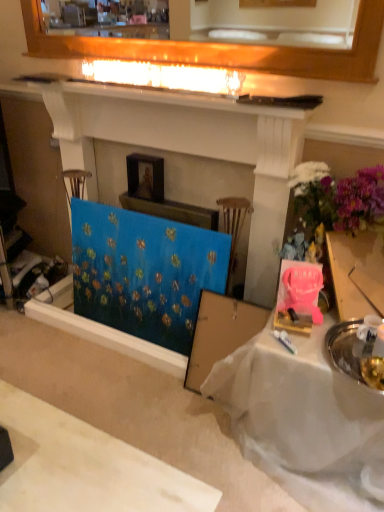
Describe the element at coordinates (175, 96) in the screenshot. I see `white glossy mantle at upper center` at that location.

Describe the element at coordinates (145, 177) in the screenshot. The image size is (384, 512). I see `wooden picture frame at upper center` at that location.

Find the location of a particular element. This screenshot has height=512, width=384. blue fabric painting at center is located at coordinates (144, 272).

This screenshot has height=512, width=384. What are the coordinates of `white cloth-covered table at lower right` in the screenshot? It's located at (303, 420).

Does white cloth-covered table at lower right touch wooden picture frame at upper center?

No, white cloth-covered table at lower right is not with wooden picture frame at upper center.

Relative to wooden picture frame at upper center, is white cloth-covered table at lower right in front or behind?

In the image, white cloth-covered table at lower right appears in front of wooden picture frame at upper center.

What's the angular difference between white cloth-covered table at lower right and wooden picture frame at upper center's facing directions?

white cloth-covered table at lower right and wooden picture frame at upper center are facing 0.00679 degrees away from each other.

Which is nearer, (319, 467) or (149, 186)?

Point (319, 467) is closer to the camera than point (149, 186).

Does point (256, 261) lie behind point (250, 416)?

Yes, point (256, 261) is farther from viewer.

Does blue canvas at center turn towards white cloth-covered table at lower right?

No, blue canvas at center does not turn towards white cloth-covered table at lower right.

Where is `table in front of the blue canvas at center`? table in front of the blue canvas at center is located at coordinates (303, 420).

How different are the orientations of blue canvas at center and white cloth-covered table at lower right in degrees?

0.00107 degrees.

Would you say blue fabric painting at center is to the left or to the right of white cloth-covered table at lower right in the picture?

blue fabric painting at center is to the left of white cloth-covered table at lower right.

From the image's perspective, does blue fabric painting at center appear lower than white cloth-covered table at lower right?

No, from the image's perspective, blue fabric painting at center is not below white cloth-covered table at lower right.

Considering the sizes of objects blue fabric painting at center and white cloth-covered table at lower right in the image provided, who is shorter, blue fabric painting at center or white cloth-covered table at lower right?

With less height is white cloth-covered table at lower right.

From the image's perspective, is white glossy mantle at upper center located above or below blue fabric painting at center?

Clearly, from the image's perspective, white glossy mantle at upper center is above blue fabric painting at center.

Would you say white glossy mantle at upper center is to the left or to the right of blue fabric painting at center in the picture?

white glossy mantle at upper center is positioned on blue fabric painting at center's right side.

Between white glossy mantle at upper center and blue fabric painting at center, which one has smaller width?

blue fabric painting at center is thinner.

From the image's perspective, is wooden picture frame at upper center beneath white cloth-covered table at lower right?

No, from the image's perspective, wooden picture frame at upper center is not beneath white cloth-covered table at lower right.

Is wooden picture frame at upper center next to white cloth-covered table at lower right and touching it?

wooden picture frame at upper center and white cloth-covered table at lower right are not in contact.

Considering the relative sizes of wooden picture frame at upper center and white cloth-covered table at lower right in the image provided, is wooden picture frame at upper center bigger than white cloth-covered table at lower right?

No, wooden picture frame at upper center is not bigger than white cloth-covered table at lower right.

How far apart are wooden picture frame at upper center and white cloth-covered table at lower right?

1.09 meters.

Is blue fabric painting at center to the left or to the right of blue canvas at center in the image?

In the image, blue fabric painting at center appears on the left side of blue canvas at center.

Can we say blue fabric painting at center lies outside blue canvas at center?

No, blue fabric painting at center is not entirely external to blue canvas at center.

From the image's perspective, which one is positioned lower, blue fabric painting at center or blue canvas at center?

blue fabric painting at center appears lower in the image.

Can you confirm if blue canvas at center is thinner than white glossy mantle at upper center?

No, blue canvas at center is not thinner than white glossy mantle at upper center.

Would you say blue canvas at center is a long distance from white glossy mantle at upper center?

They are positioned close to each other.

Considering the points (290, 106) and (212, 106), which point is behind, point (290, 106) or point (212, 106)?

The point (212, 106) is behind.

Is white glossy mantle at upper center inside blue canvas at center?

No, white glossy mantle at upper center is not inside blue canvas at center.

Where is `table that appears on the right of wooden picture frame at upper center`? table that appears on the right of wooden picture frame at upper center is located at coordinates tap(303, 420).

What are the coordinates of `table below the blue canvas at center (from a real-world perspective)` in the screenshot? It's located at (303, 420).

Estimate the real-world distances between objects in this image. Which object is closer to blue fabric painting at center, white cloth-covered table at lower right or white glossy mantle at upper center?

white cloth-covered table at lower right is positioned closer to the anchor blue fabric painting at center.

Which object lies nearer to the anchor point blue canvas at center, white cloth-covered table at lower right or white glossy mantle at upper center?

white glossy mantle at upper center is positioned closer to the anchor blue canvas at center.

When comparing their distances from white cloth-covered table at lower right, does wooden picture frame at upper center or blue canvas at center seem closer?

blue canvas at center.

Which object lies nearer to the anchor point blue canvas at center, blue fabric painting at center or white cloth-covered table at lower right?

blue fabric painting at center is positioned closer to the anchor blue canvas at center.

Looking at the image, which one is located further to white glossy mantle at upper center, blue canvas at center or white cloth-covered table at lower right?

white cloth-covered table at lower right is positioned further to the anchor white glossy mantle at upper center.

Looking at the image, which one is located closer to white glossy mantle at upper center, white cloth-covered table at lower right or blue fabric painting at center?

The object closer to white glossy mantle at upper center is blue fabric painting at center.

Based on their spatial positions, is white glossy mantle at upper center or white cloth-covered table at lower right closer to blue fabric painting at center?

white cloth-covered table at lower right lies closer to blue fabric painting at center than the other object.

Considering their positions, is white cloth-covered table at lower right positioned closer to white glossy mantle at upper center than blue canvas at center?

blue canvas at center lies closer to white glossy mantle at upper center than the other object.

The height and width of the screenshot is (512, 384). I want to click on curtain between white glossy mantle at upper center and white cloth-covered table at lower right from top to bottom, so click(144, 272).

In order to click on picture frame between white glossy mantle at upper center and blue fabric painting at center from top to bottom in this screenshot , I will do `click(145, 177)`.

The image size is (384, 512). I want to click on curtain between white cloth-covered table at lower right and wooden picture frame at upper center along the z-axis, so click(144, 272).

Identify the location of fireplace between white glossy mantle at upper center and blue fabric painting at center vertically. The width and height of the screenshot is (384, 512). (192, 149).